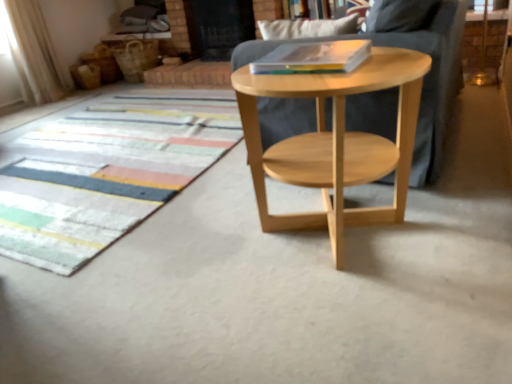
This screenshot has width=512, height=384. In order to click on free space in front of natural wood side table at center in this screenshot , I will do `click(353, 323)`.